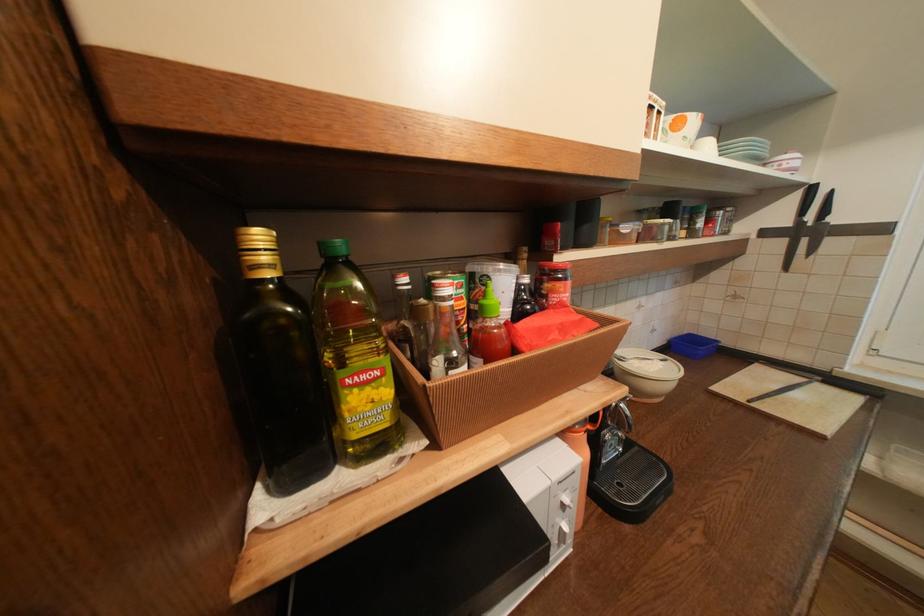
This screenshot has height=616, width=924. What do you see at coordinates (646, 373) in the screenshot? I see `the striped ceramic bowl` at bounding box center [646, 373].